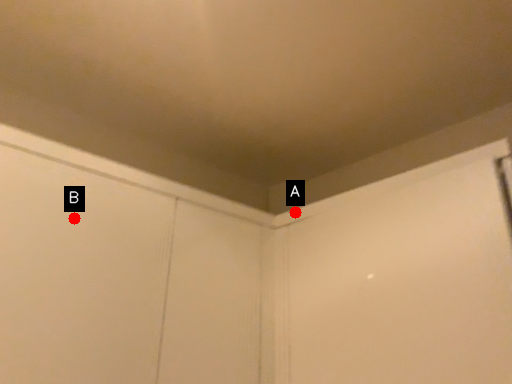
Question: Two points are circled on the image, labeled by A and B beside each circle. Which point is closer to the camera taking this photo?

Choices:
 (A) A is closer
 (B) B is closer

Answer: (B)